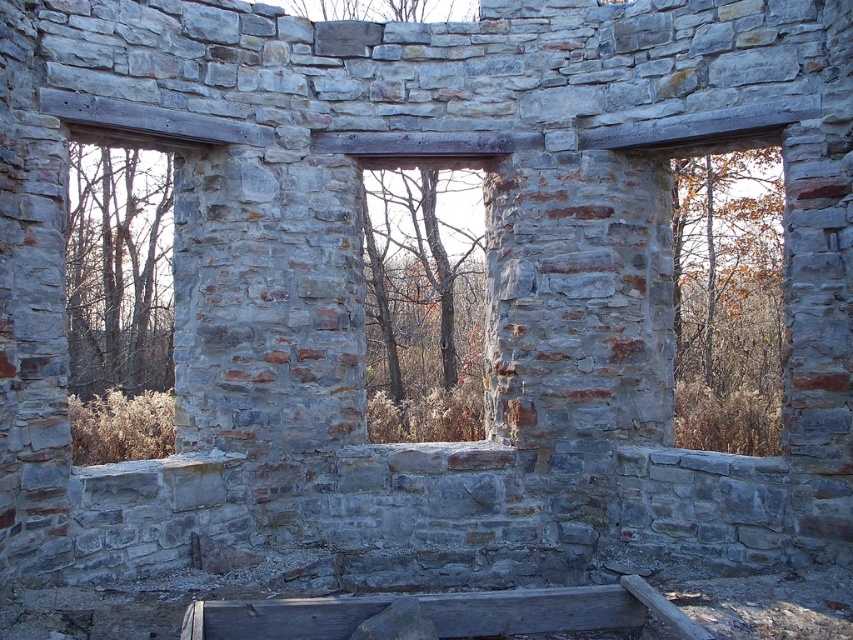
Does stone window frame at center lie in front of smooth gray wood at lower center?

No, it is behind smooth gray wood at lower center.

Who is more distant from viewer, (399, 193) or (351, 630)?

The point (399, 193) is behind.

Between point (428, 337) and point (635, 592), which one is positioned behind?

Point (428, 337)

The width and height of the screenshot is (853, 640). I want to click on stone window frame at center, so click(422, 308).

Is point (100, 252) closer to camera compared to point (453, 355)?

No.

Can you confirm if gray stone window frame at left is taller than stone window frame at center?

Yes.

Locate an element on the screen. The width and height of the screenshot is (853, 640). gray stone window frame at left is located at coordinates (119, 305).

Which is below, gray stone window frame at left or smooth gray wood at lower center?

smooth gray wood at lower center is below.

Between gray stone window frame at left and smooth gray wood at lower center, which one has less height?

With less height is smooth gray wood at lower center.

This screenshot has width=853, height=640. In order to click on gray stone window frame at left in this screenshot , I will do `click(119, 305)`.